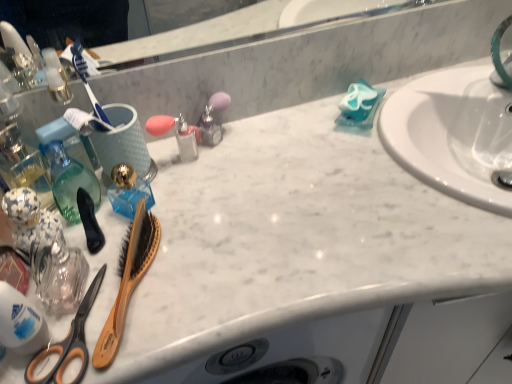
Question: Does translucent plastic bottle at lower left, which ranks as the 2th cleaning product in top-to-bottom order, come behind translucent blue glass at center?

Choices:
 (A) no
 (B) yes

Answer: (A)

Question: Does translucent plastic bottle at lower left, acting as the first cleaning product starting from the front, appear on the right side of translucent blue glass at center?

Choices:
 (A) yes
 (B) no

Answer: (B)

Question: Considering the relative sizes of translucent plastic bottle at lower left, the first cleaning product positioned from the left, and translucent blue glass at center in the image provided, is translucent plastic bottle at lower left, the first cleaning product positioned from the left, thinner than translucent blue glass at center?

Choices:
 (A) no
 (B) yes

Answer: (B)

Question: Considering the relative sizes of translucent plastic bottle at lower left, the first cleaning product positioned from the left, and translucent blue glass at center in the image provided, is translucent plastic bottle at lower left, the first cleaning product positioned from the left, taller than translucent blue glass at center?

Choices:
 (A) yes
 (B) no

Answer: (A)

Question: Is translucent plastic bottle at lower left, which ranks as the 2th cleaning product in top-to-bottom order, facing away from translucent blue glass at center?

Choices:
 (A) yes
 (B) no

Answer: (B)

Question: Is translucent plastic bottle at lower left, positioned as the 1th cleaning product in bottom-to-top order, taller or shorter than blue matte soap at upper right, which is counted as the second cleaning product, starting from the left?

Choices:
 (A) short
 (B) tall

Answer: (B)

Question: Is translucent plastic bottle at lower left, which is counted as the 2th cleaning product, starting from the right, wider or thinner than blue matte soap at upper right, the second cleaning product from the bottom?

Choices:
 (A) thin
 (B) wide

Answer: (A)

Question: Considering the positions of point tap(7, 284) and point tap(350, 99), is point tap(7, 284) closer or farther from the camera than point tap(350, 99)?

Choices:
 (A) closer
 (B) farther

Answer: (A)

Question: From the image's perspective, is translucent plastic bottle at lower left, acting as the first cleaning product starting from the front, above or below blue matte soap at upper right, the first cleaning product from the right?

Choices:
 (A) below
 (B) above

Answer: (A)

Question: Is point (119, 178) positioned closer to the camera than point (5, 297)?

Choices:
 (A) farther
 (B) closer

Answer: (A)

Question: Is translucent blue glass at center taller or shorter than translucent plastic bottle at lower left, positioned as the 1th cleaning product in bottom-to-top order?

Choices:
 (A) short
 (B) tall

Answer: (A)

Question: Considering the positions of translucent blue glass at center and translucent plastic bottle at lower left, the first cleaning product positioned from the left, in the image, is translucent blue glass at center wider or thinner than translucent plastic bottle at lower left, the first cleaning product positioned from the left,?

Choices:
 (A) thin
 (B) wide

Answer: (B)

Question: Looking at the image, does translucent blue glass at center seem bigger or smaller compared to translucent plastic bottle at lower left, positioned as the 1th cleaning product in bottom-to-top order?

Choices:
 (A) big
 (B) small

Answer: (A)

Question: Looking at the image, does translucent blue glass at center seem bigger or smaller compared to black rubber brush at left, the second brush positioned from the right?

Choices:
 (A) small
 (B) big

Answer: (B)

Question: From a real-world perspective, relative to black rubber brush at left, which is the first brush in left-to-right order, is translucent blue glass at center vertically above or below?

Choices:
 (A) below
 (B) above

Answer: (A)